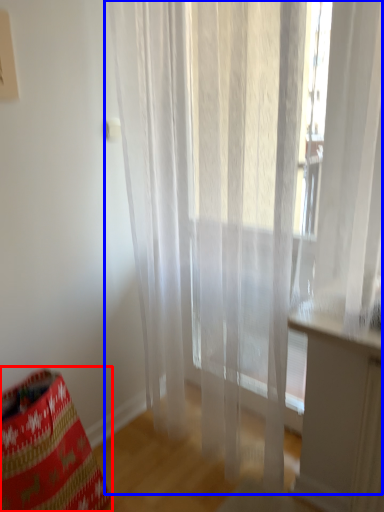
Question: Which object appears closest to the camera in this image, bean bag chair (highlighted by a red box) or curtain (highlighted by a blue box)?

Choices:
 (A) bean bag chair
 (B) curtain

Answer: (B)